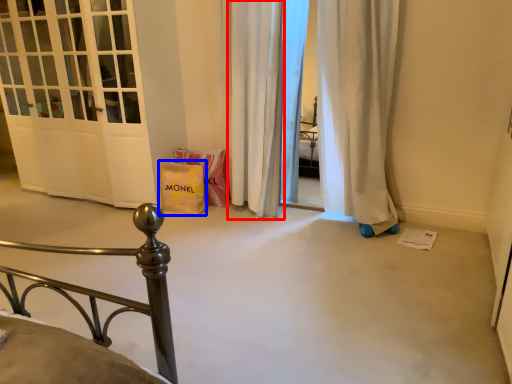
Question: Among these objects, which one is farthest to the camera, curtain (highlighted by a red box) or gift bag (highlighted by a blue box)?

Choices:
 (A) curtain
 (B) gift bag

Answer: (B)